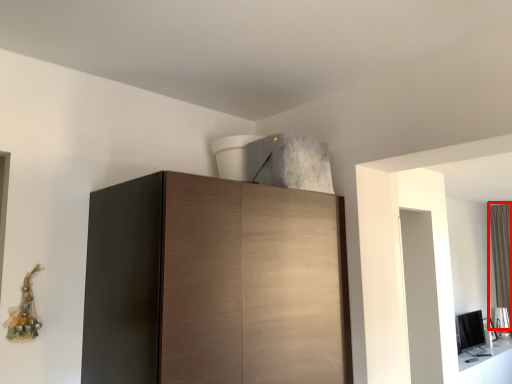
Question: From the image's perspective, considering the relative positions of curtain (annotated by the red box) and cupboard in the image provided, where is curtain (annotated by the red box) located with respect to the staircase?

Choices:
 (A) above
 (B) below

Answer: (B)